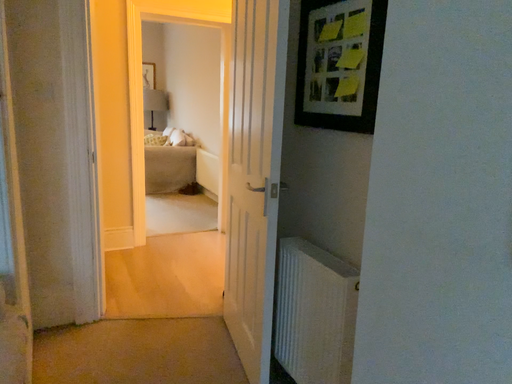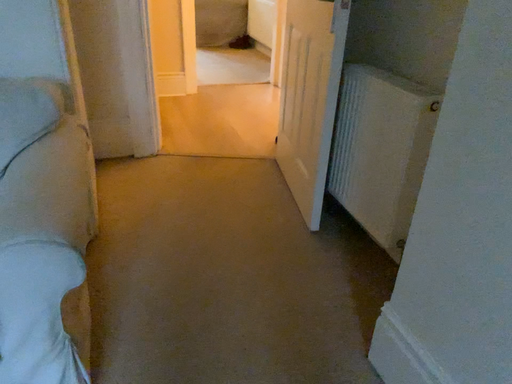
Question: How did the camera likely rotate when shooting the video?

Choices:
 (A) rotated left
 (B) rotated right

Answer: (A)